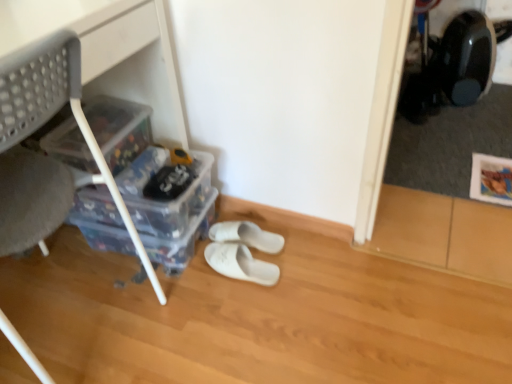
Find the location of a particular element. vacant area situated below white plastic chair at left (from a real-world perspective) is located at coordinates (69, 326).